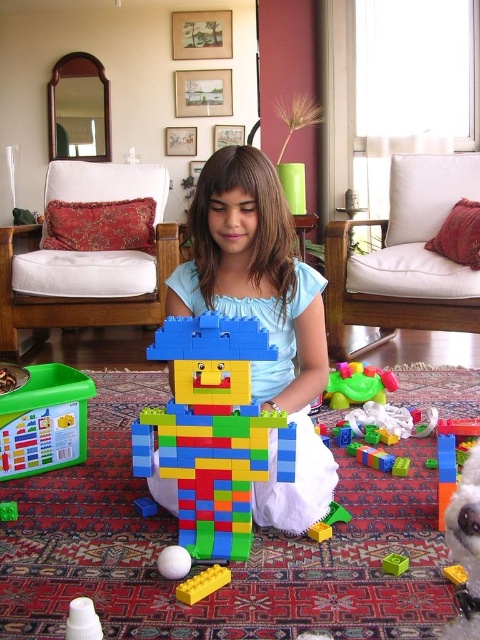
Which is below, white plastic cup at lower left or bright yellow plastic block at center?

white plastic cup at lower left is below.

Can you confirm if white plastic cup at lower left is positioned to the left of bright yellow plastic block at center?

Indeed, white plastic cup at lower left is positioned on the left side of bright yellow plastic block at center.

What do you see at coordinates (83, 620) in the screenshot?
I see `white plastic cup at lower left` at bounding box center [83, 620].

I want to click on white plastic cup at lower left, so click(83, 620).

Could you measure the distance between translucent green plastic container at lower left and white plastic cup at lower left?

translucent green plastic container at lower left and white plastic cup at lower left are 25.57 inches apart from each other.

This screenshot has width=480, height=640. What do you see at coordinates (45, 420) in the screenshot?
I see `translucent green plastic container at lower left` at bounding box center [45, 420].

Identify the location of translucent green plastic container at lower left. (45, 420).

Between point (374, 387) and point (397, 564), which one is positioned in front?

Point (397, 564) is more forward.

Who is more distant from viewer, (349, 364) or (397, 557)?

Positioned behind is point (349, 364).

Measure the distance between point (380, 388) and camera.

The distance of point (380, 388) from camera is 6.92 feet.

I want to click on translucent green plastic toy at center, so click(358, 385).